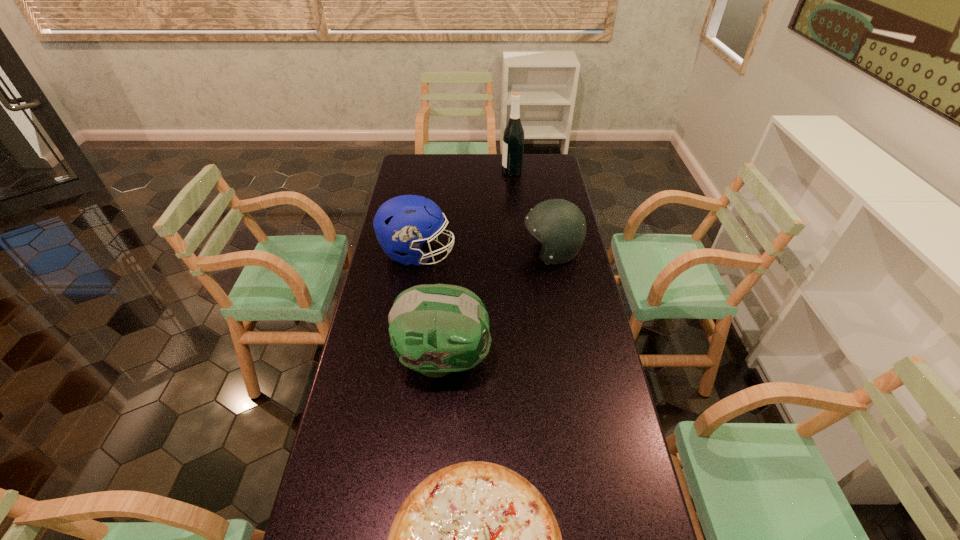
Locate an element on the screen. Image resolution: width=960 pixels, height=540 pixels. free location located 0.060m at the face opening of the rightmost football helmet is located at coordinates (506, 252).

This screenshot has width=960, height=540. I want to click on object located at the far edge, so point(513,138).

In order to click on object that is at the right edge in this screenshot , I will do `click(559, 225)`.

At what (x,y) coordinates should I click in order to perform the action: click on free region at the left edge of the desktop. Please return your answer as a coordinate pair (x, y). Looking at the image, I should click on (356, 378).

Locate an element on the screen. The height and width of the screenshot is (540, 960). vacant space at the right edge of the desktop is located at coordinates (559, 189).

In the image, there is a desktop. Where is `vacant space at the far left corner`? This screenshot has width=960, height=540. vacant space at the far left corner is located at coordinates (x=409, y=176).

At what (x,y) coordinates should I click in order to perform the action: click on vacant space at the far right corner of the desktop. Please return your answer as a coordinate pair (x, y). The image size is (960, 540). Looking at the image, I should click on (560, 172).

Find the location of a particular element. The width and height of the screenshot is (960, 540). free area in between the rightmost football helmet and the nearest football helmet is located at coordinates tap(497, 306).

Identify the location of empty space between the rightmost football helmet and the nearest football helmet. The image size is (960, 540). (497, 306).

I want to click on object that is the third closest one to the shortest object, so click(x=559, y=225).